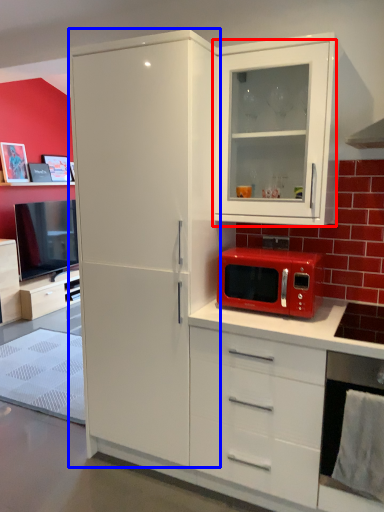
Question: Which object appears closest to the camera in this image, cabinetry (highlighted by a red box) or refrigerator (highlighted by a blue box)?

Choices:
 (A) cabinetry
 (B) refrigerator

Answer: (B)